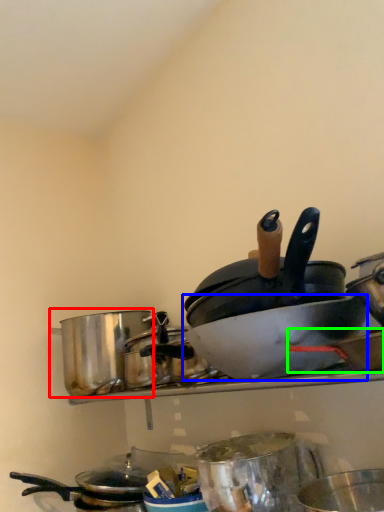
Question: Which is nearer to the crock pot (highlighted by a red box)? basin (highlighted by a blue box) or wok (highlighted by a green box).

Choices:
 (A) basin
 (B) wok

Answer: (A)